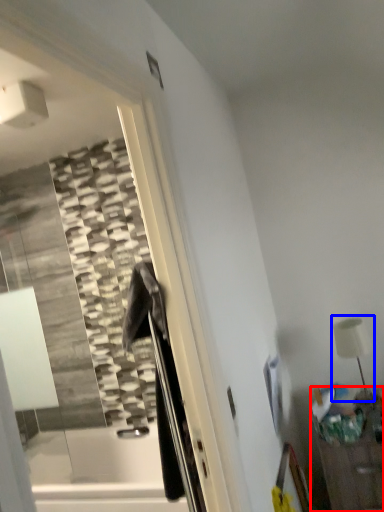
Question: Which object is closer to the camera taking this photo, furniture (highlighted by a red box) or table lamp (highlighted by a blue box)?

Choices:
 (A) furniture
 (B) table lamp

Answer: (A)